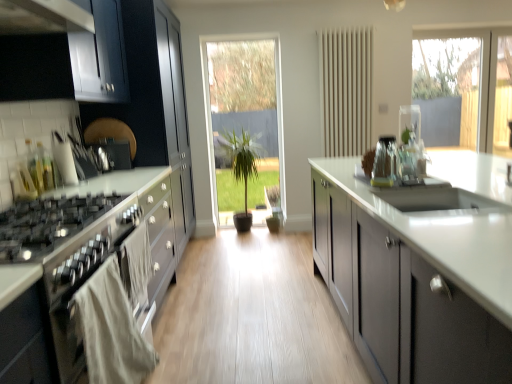
The width and height of the screenshot is (512, 384). Find the location of `free point in front of transparent glass door at center`. free point in front of transparent glass door at center is located at coordinates (253, 232).